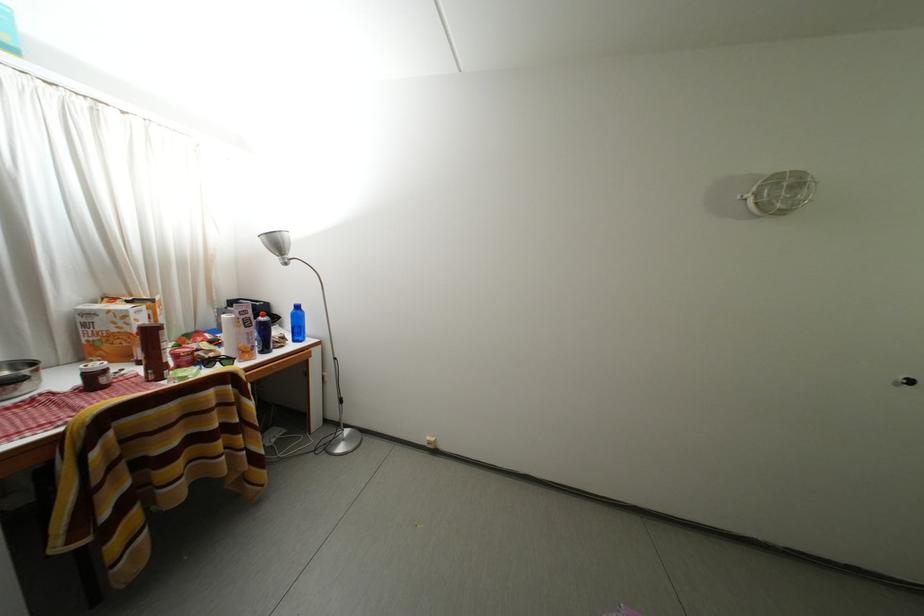
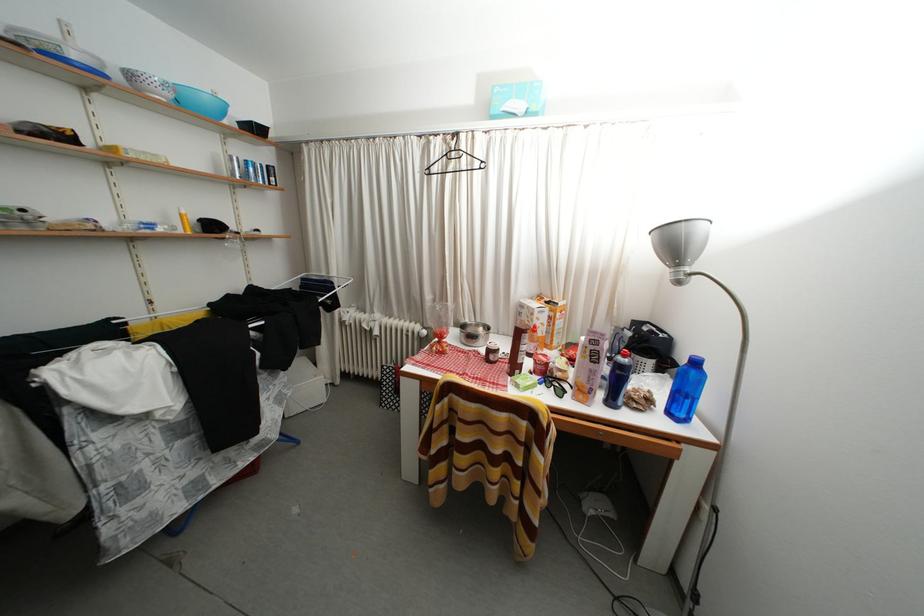
In the second image, find the point that corresponds to (302,346) in the first image.

(676, 419)